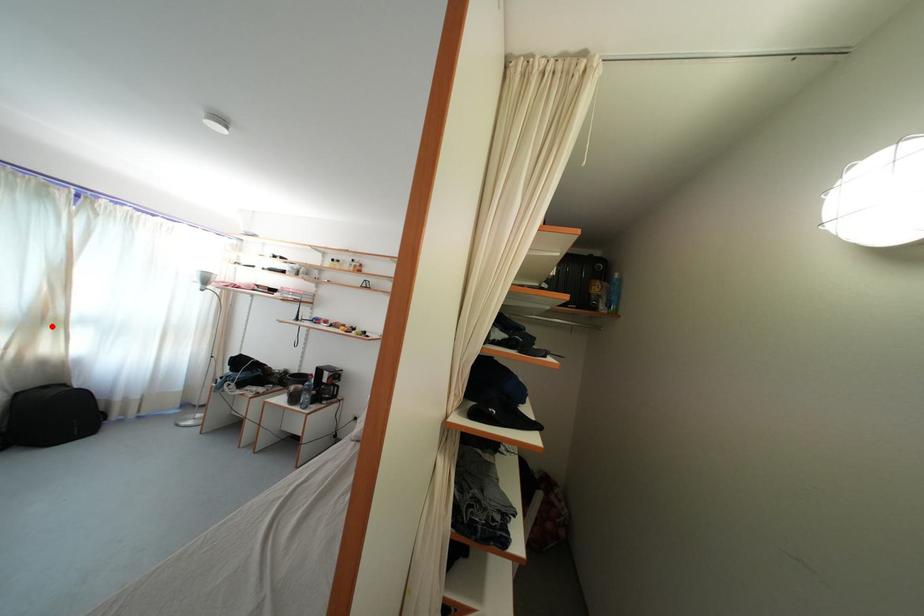
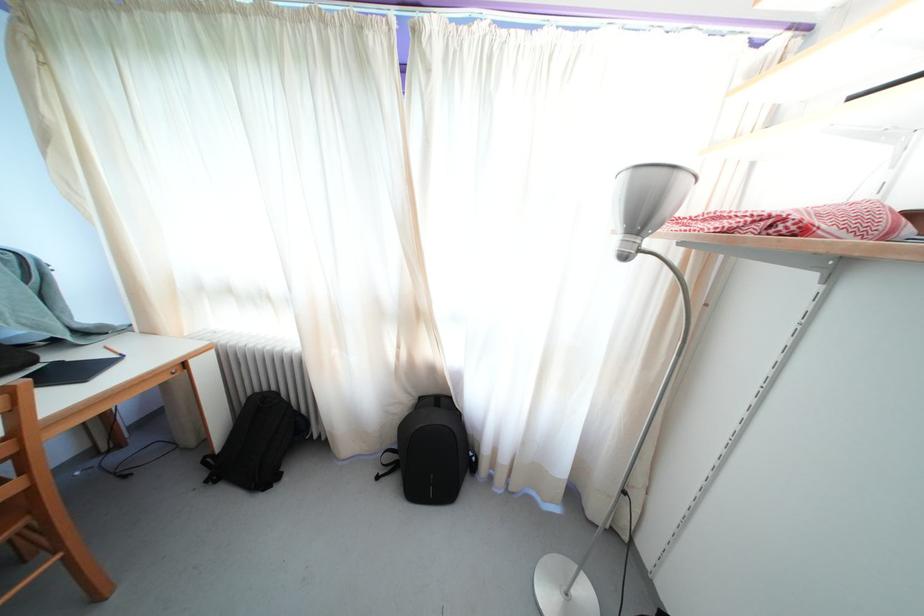
In the second image, find the point that corresponds to the highlighted location in the first image.

(421, 321)